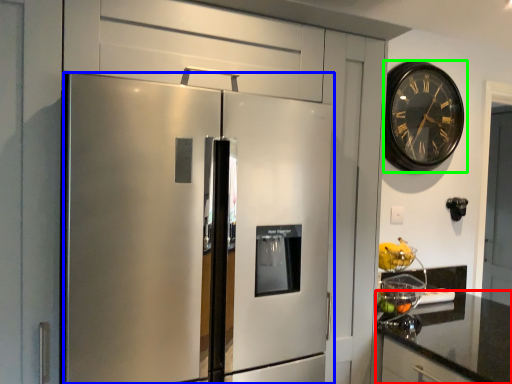
Question: Considering the real-world distances, which object is closest to countertop (highlighted by a red box)? refrigerator (highlighted by a blue box) or wall clock (highlighted by a green box).

Choices:
 (A) refrigerator
 (B) wall clock

Answer: (A)